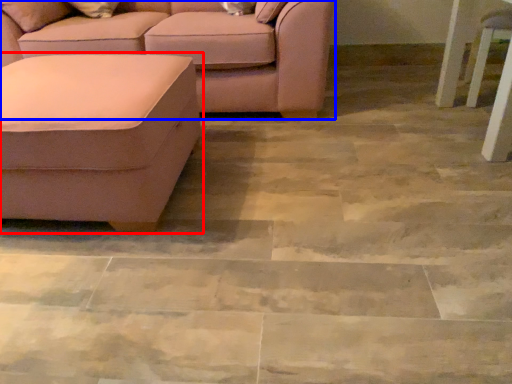
Question: Which object is further to the camera taking this photo, studio couch (highlighted by a red box) or studio couch (highlighted by a blue box)?

Choices:
 (A) studio couch
 (B) studio couch

Answer: (B)